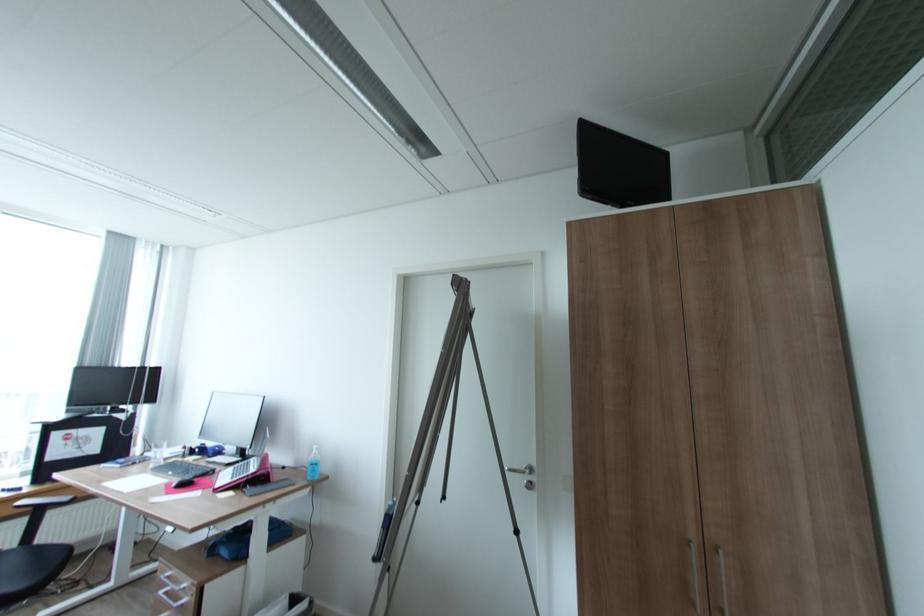
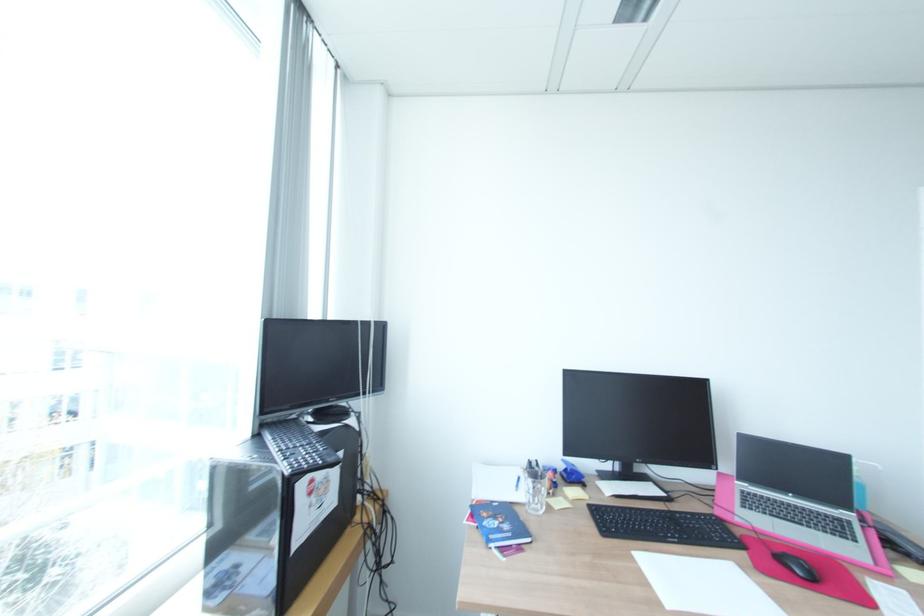
In the second image, find the point that corresponds to [176,472] in the first image.

(681, 541)